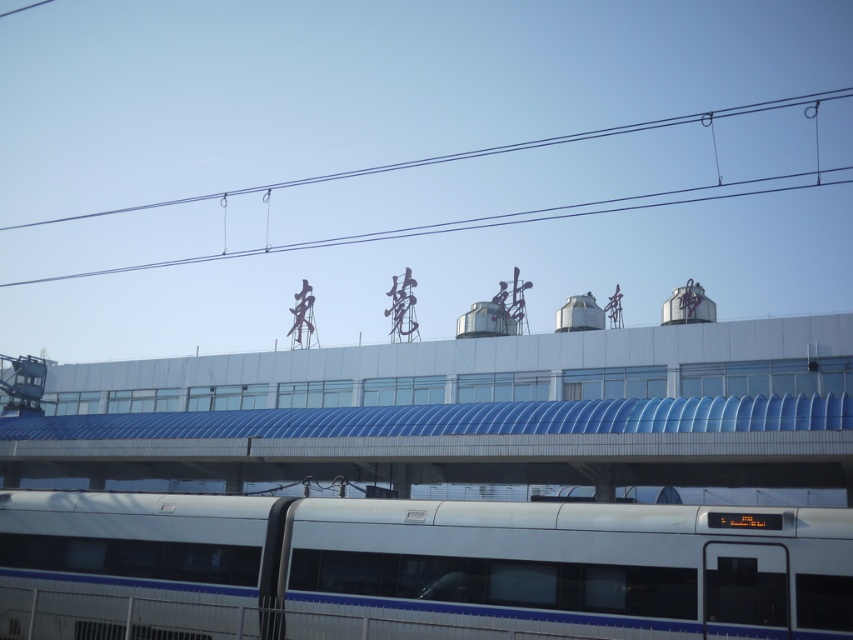
You are a maintenance worker checking the train station. You see the white glossy passenger train at bottom and the black wire at upper center. Which object is located below the other?

The white glossy passenger train at bottom is positioned under the black wire at upper center.